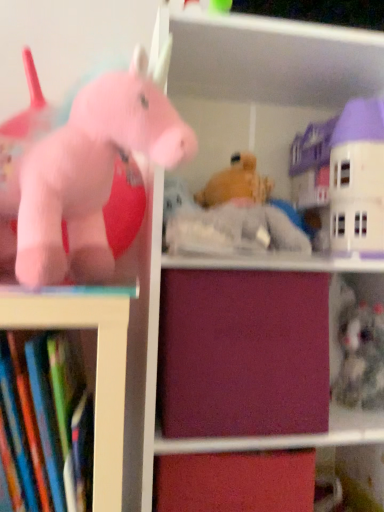
Question: Can you confirm if matte pink plush unicorn at left, which appears as the 3th toy when viewed from the right, is smaller than burgundy matte drawer at center?

Choices:
 (A) yes
 (B) no

Answer: (A)

Question: Is matte pink plush unicorn at left, the 3th toy when ordered from back to front, outside of burgundy matte drawer at center?

Choices:
 (A) no
 (B) yes

Answer: (B)

Question: From the image's perspective, would you say matte pink plush unicorn at left, which is the first toy in front-to-back order, is shown under burgundy matte drawer at center?

Choices:
 (A) yes
 (B) no

Answer: (B)

Question: Does matte pink plush unicorn at left, which ranks as the 1th toy in left-to-right order, appear on the left side of burgundy matte drawer at center?

Choices:
 (A) yes
 (B) no

Answer: (A)

Question: Is matte pink plush unicorn at left, which appears as the 3th toy when viewed from the right, to the right of burgundy matte drawer at center from the viewer's perspective?

Choices:
 (A) no
 (B) yes

Answer: (A)

Question: Is the position of matte pink plush unicorn at left, the 3th toy when ordered from back to front, more distant than that of burgundy matte drawer at center?

Choices:
 (A) yes
 (B) no

Answer: (B)

Question: Does hardcover books at left have a greater height compared to fuzzy gray stuffed animal at lower right, acting as the 3th toy starting from the left?

Choices:
 (A) no
 (B) yes

Answer: (B)

Question: Considering the relative positions of hardcover books at left and fuzzy gray stuffed animal at lower right, which ranks as the 3th toy in front-to-back order, in the image provided, is hardcover books at left to the left of fuzzy gray stuffed animal at lower right, which ranks as the 3th toy in front-to-back order, from the viewer's perspective?

Choices:
 (A) yes
 (B) no

Answer: (A)

Question: From a real-world perspective, is hardcover books at left under fuzzy gray stuffed animal at lower right, which is the 1th toy from right to left?

Choices:
 (A) yes
 (B) no

Answer: (A)

Question: Is hardcover books at left facing towards fuzzy gray stuffed animal at lower right, the first toy positioned from the back?

Choices:
 (A) no
 (B) yes

Answer: (A)

Question: Is hardcover books at left not close to fuzzy gray stuffed animal at lower right, acting as the 3th toy starting from the left?

Choices:
 (A) no
 (B) yes

Answer: (A)

Question: Considering the relative sizes of hardcover books at left and fuzzy gray stuffed animal at lower right, which ranks as the 3th toy in front-to-back order, in the image provided, is hardcover books at left thinner than fuzzy gray stuffed animal at lower right, which ranks as the 3th toy in front-to-back order,?

Choices:
 (A) yes
 (B) no

Answer: (A)

Question: From the image's perspective, would you say fuzzy gray stuffed animal at lower right, acting as the 3th toy starting from the left, is positioned over pastel cream plastic house at upper right, the 2th toy positioned from the left?

Choices:
 (A) no
 (B) yes

Answer: (A)